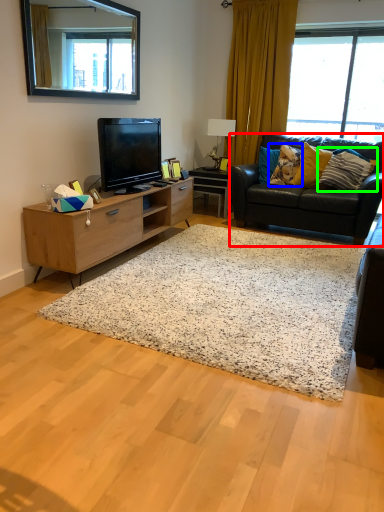
Question: Which object is the closest to the studio couch (highlighted by a red box)? Choose among these: pillow (highlighted by a blue box) or pillow (highlighted by a green box).

Choices:
 (A) pillow
 (B) pillow

Answer: (B)